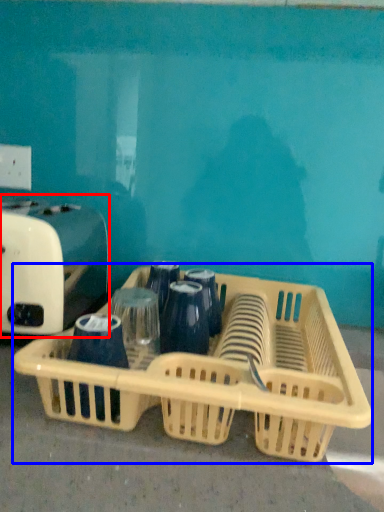
Question: Which object is further to the camera taking this photo, toaster (highlighted by a red box) or basket (highlighted by a blue box)?

Choices:
 (A) toaster
 (B) basket

Answer: (A)